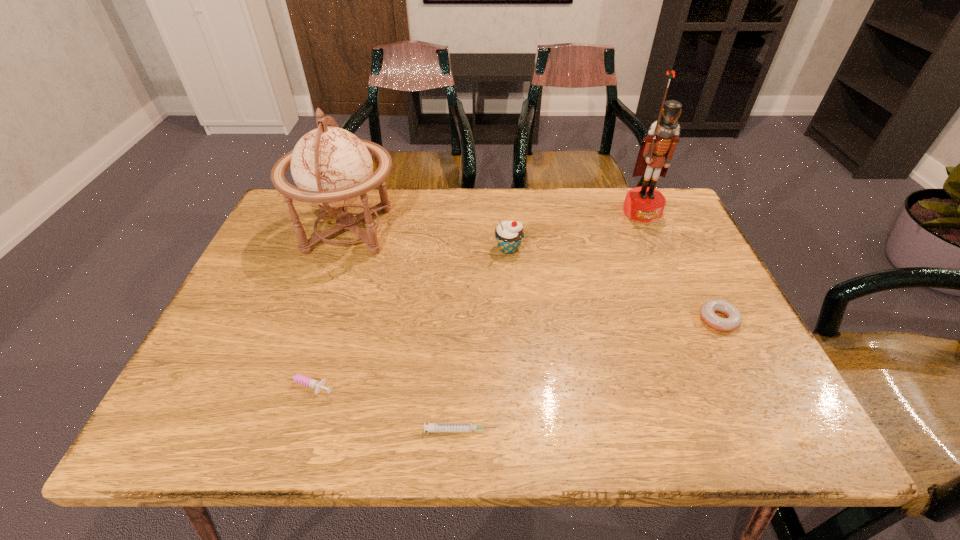
You are a GUI agent. You are given a task and a screenshot of the screen. Output one action in this format:
    pyautogui.click(x=<x>, y=<y>)
    Task: Click on the nutcracker positioned at the right edge
    
    Given the screenshot: What is the action you would take?
    pyautogui.click(x=645, y=204)

This screenshot has height=540, width=960. Identify the location of doughnut that is at the right edge. (734, 318).

This screenshot has width=960, height=540. I want to click on object that is at the far left corner, so (x=332, y=167).

Identify the location of object at the far right corner. (645, 204).

This screenshot has height=540, width=960. What are the coordinates of `vacant space at the far edge` in the screenshot? It's located at (467, 232).

In order to click on free space at the near edge in this screenshot , I will do `click(637, 402)`.

I want to click on vacant space at the left edge of the desktop, so click(239, 358).

Where is `vacant region at the right edge`? This screenshot has height=540, width=960. vacant region at the right edge is located at coordinates pyautogui.click(x=670, y=285).

I want to click on free space at the far left corner of the desktop, so click(x=296, y=206).

Where is `vacant space at the near left corner`? This screenshot has height=540, width=960. vacant space at the near left corner is located at coordinates (222, 402).